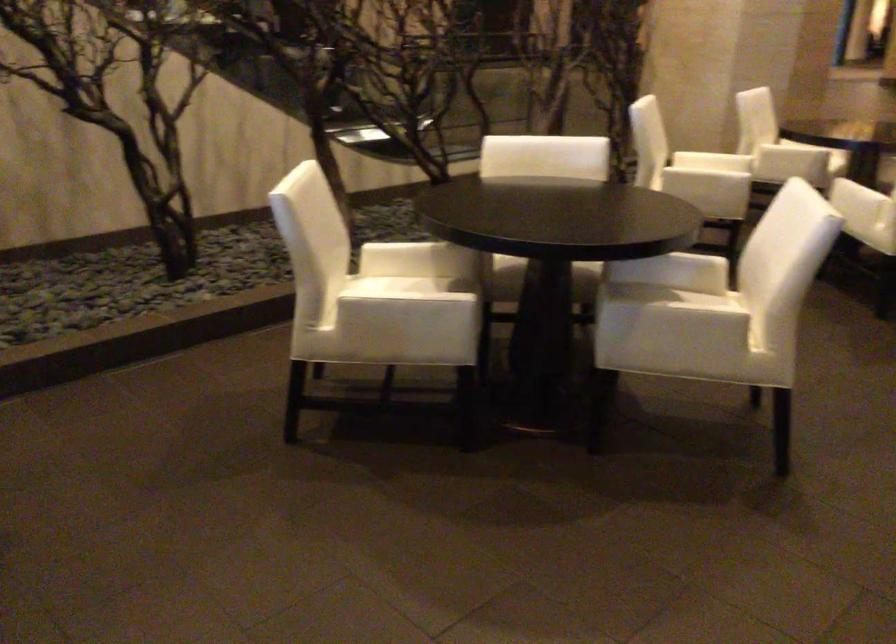
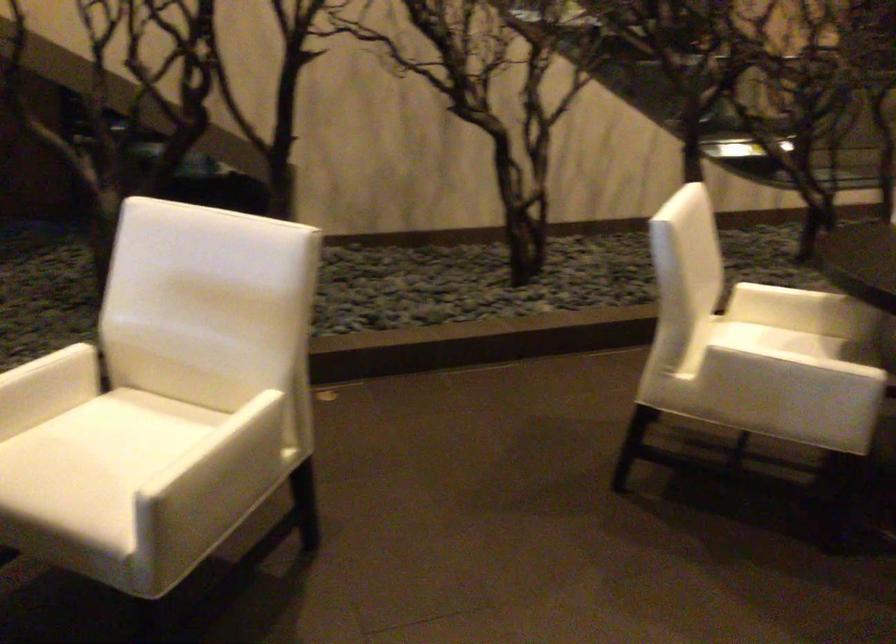
In the second image, find the point that corresponds to point 395,261 in the first image.

(778, 305)